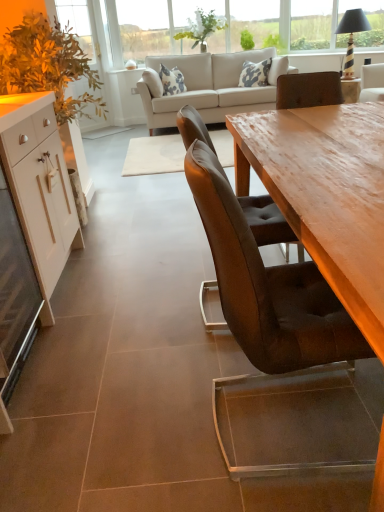
Question: Which direction should I rotate to look at green leafy plant at upper center, which is counted as the 2th plant, starting from the right?

Choices:
 (A) right
 (B) left

Answer: (A)

Question: Considering the relative sizes of green leafy plant at upper center, which is counted as the 2th plant, starting from the right, and beige fabric couch at upper center in the image provided, is green leafy plant at upper center, which is counted as the 2th plant, starting from the right, bigger than beige fabric couch at upper center?

Choices:
 (A) yes
 (B) no

Answer: (B)

Question: Is green leafy plant at upper center, which is counted as the 2th plant, starting from the right, at the right side of beige fabric couch at upper center?

Choices:
 (A) yes
 (B) no

Answer: (B)

Question: Is green leafy plant at upper center, which appears as the 1th plant when viewed from the left, at the left side of beige fabric couch at upper center?

Choices:
 (A) no
 (B) yes

Answer: (B)

Question: Is green leafy plant at upper center, which appears as the 1th plant when viewed from the left, taller than beige fabric couch at upper center?

Choices:
 (A) no
 (B) yes

Answer: (A)

Question: Can beige fabric couch at upper center be found inside green leafy plant at upper center, which appears as the 1th plant when viewed from the left?

Choices:
 (A) yes
 (B) no

Answer: (B)

Question: Is green leafy plant at upper center, which appears as the 1th plant when viewed from the left, outside of beige fabric couch at upper center?

Choices:
 (A) no
 (B) yes

Answer: (B)

Question: Is white glossy cabinet at left oriented towards white glossy cabinet at left?

Choices:
 (A) yes
 (B) no

Answer: (B)

Question: From the image's perspective, is white glossy cabinet at left on white glossy cabinet at left?

Choices:
 (A) no
 (B) yes

Answer: (A)

Question: Is white glossy cabinet at left taller than white glossy cabinet at left?

Choices:
 (A) no
 (B) yes

Answer: (A)

Question: Is white glossy cabinet at left beside white glossy cabinet at left?

Choices:
 (A) no
 (B) yes

Answer: (A)

Question: Does white glossy cabinet at left have a greater width compared to white glossy cabinet at left?

Choices:
 (A) yes
 (B) no

Answer: (B)

Question: Considering the relative positions of white glossy cabinet at left and white glossy cabinet at left in the image provided, is white glossy cabinet at left to the left of white glossy cabinet at left from the viewer's perspective?

Choices:
 (A) yes
 (B) no

Answer: (B)

Question: Is white glossy cabinet at left oriented towards leather chair at center?

Choices:
 (A) no
 (B) yes

Answer: (B)